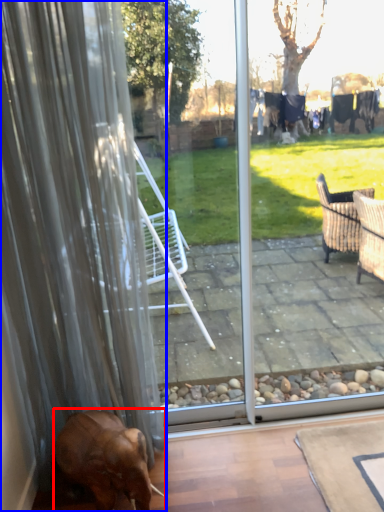
Question: Among these objects, which one is farthest to the camera, dog (highlighted by a red box) or curtain (highlighted by a blue box)?

Choices:
 (A) dog
 (B) curtain

Answer: (A)